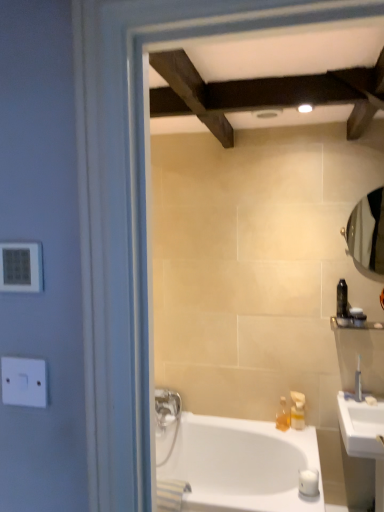
This screenshot has width=384, height=512. I want to click on translucent plastic soap dispenser at right, which appears as the third toiletry when viewed from the right, so click(x=297, y=410).

Describe the element at coordinates (309, 482) in the screenshot. I see `white matte soap at lower right` at that location.

Measure the distance between white plastic electric outlet at left, which is the 2th electric outlet in bottom-to-top order, and camera.

white plastic electric outlet at left, which is the 2th electric outlet in bottom-to-top order, is 28.49 inches away from camera.

What is the approximate height of white plastic electric outlet at left, acting as the first electric outlet starting from the top?

The height of white plastic electric outlet at left, acting as the first electric outlet starting from the top, is 3.70 inches.

The width and height of the screenshot is (384, 512). What are the coordinates of `satin nickel faucet at right` in the screenshot? It's located at (358, 382).

What is the approximate width of black glossy bottle at upper right, the 1th toiletry from the top?

It is 8.05 centimeters.

Image resolution: width=384 pixels, height=512 pixels. What are the coordinates of `translucent plastic soap dispenser at right, which appears as the third toiletry when viewed from the right` in the screenshot? It's located at (297, 410).

Is white glossy bathtub at lower center surrounded by black glossy bottle at upper right, the 2th toiletry in the left-to-right sequence?

Actually, white glossy bathtub at lower center is outside black glossy bottle at upper right, the 2th toiletry in the left-to-right sequence.

In terms of size, does black glossy bottle at upper right, which ranks as the 3th toiletry in bottom-to-top order, appear bigger or smaller than white glossy bathtub at lower center?

Considering their sizes, black glossy bottle at upper right, which ranks as the 3th toiletry in bottom-to-top order, takes up less space than white glossy bathtub at lower center.

Would you say black glossy bottle at upper right, the 1th toiletry from the top, is to the left or to the right of white glossy bathtub at lower center in the picture?

Based on their positions, black glossy bottle at upper right, the 1th toiletry from the top, is located to the right of white glossy bathtub at lower center.

From the image's perspective, which one is positioned lower, black glossy bottle at upper right, the 2th toiletry in the left-to-right sequence, or white glossy bathtub at lower center?

white glossy bathtub at lower center.

The image size is (384, 512). I want to click on mirror above the satin nickel faucet at right (from the image's perspective), so click(367, 231).

Consider the image. Which object is closer to the camera taking this photo, satin nickel faucet at right or clear glass mirror at right?

clear glass mirror at right is in front.

From a real-world perspective, is satin nickel faucet at right positioned under clear glass mirror at right based on gravity?

Indeed, from a real-world perspective, satin nickel faucet at right is positioned beneath clear glass mirror at right.

How much distance is there between satin nickel faucet at right and clear glass mirror at right?

satin nickel faucet at right and clear glass mirror at right are 65.45 centimeters apart.

Where is `bathtub located on the left of translucent plastic soap dispenser at right, which is the 1th toiletry in right-to-left order`? The height and width of the screenshot is (512, 384). bathtub located on the left of translucent plastic soap dispenser at right, which is the 1th toiletry in right-to-left order is located at coordinates (x=231, y=464).

Is white glossy bathtub at lower center aimed at translucent plastic soap dispenser at right, acting as the second toiletry starting from the top?

No, white glossy bathtub at lower center does not turn towards translucent plastic soap dispenser at right, acting as the second toiletry starting from the top.

From the image's perspective, which is below, white glossy bathtub at lower center or translucent plastic soap dispenser at right, which is the 1th toiletry in right-to-left order?

white glossy bathtub at lower center is shown below in the image.

Is white glossy bathtub at lower center to the left of black glossy bottle at upper right, the 1th toiletry from the top, from the viewer's perspective?

Yes, white glossy bathtub at lower center is to the left of black glossy bottle at upper right, the 1th toiletry from the top.

Who is smaller, white glossy bathtub at lower center or black glossy bottle at upper right, which ranks as the 3th toiletry in bottom-to-top order?

black glossy bottle at upper right, which ranks as the 3th toiletry in bottom-to-top order, is smaller.

Is white glossy bathtub at lower center taller or shorter than black glossy bottle at upper right, the 1th toiletry from the top?

Considering their sizes, white glossy bathtub at lower center has more height than black glossy bottle at upper right, the 1th toiletry from the top.

How far apart are white glossy bathtub at lower center and black glossy bottle at upper right, which ranks as the 3th toiletry in bottom-to-top order?

A distance of 36.80 inches exists between white glossy bathtub at lower center and black glossy bottle at upper right, which ranks as the 3th toiletry in bottom-to-top order.

Does satin nickel faucet at right have a lesser width compared to translucent plastic soap dispenser at right, positioned as the 2th toiletry in bottom-to-top order?

Yes.

Can you confirm if satin nickel faucet at right is bigger than translucent plastic soap dispenser at right, which is the 1th toiletry in right-to-left order?

→ Incorrect, satin nickel faucet at right is not larger than translucent plastic soap dispenser at right, which is the 1th toiletry in right-to-left order.

From a real-world perspective, does satin nickel faucet at right sit lower than translucent plastic soap dispenser at right, positioned as the 2th toiletry in bottom-to-top order?

Yes.

From the image's perspective, which one is positioned lower, satin nickel faucet at right or translucent plastic soap dispenser at right, acting as the second toiletry starting from the top?

satin nickel faucet at right appears lower in the image.

Considering the sizes of satin nickel faucet at right and white plastic switch at left, the second electric outlet when ordered from top to bottom, in the image, is satin nickel faucet at right taller or shorter than white plastic switch at left, the second electric outlet when ordered from top to bottom,?

In the image, satin nickel faucet at right appears to be taller than white plastic switch at left, the second electric outlet when ordered from top to bottom.

Would you say satin nickel faucet at right is to the left or to the right of white plastic switch at left, the second electric outlet when ordered from top to bottom, in the picture?

satin nickel faucet at right is positioned on white plastic switch at left, the second electric outlet when ordered from top to bottom,'s right side.

Does satin nickel faucet at right have a smaller size compared to white plastic switch at left, which is the first electric outlet in bottom-to-top order?

No.

Can you tell me how much satin nickel faucet at right and white plastic switch at left, the second electric outlet when ordered from top to bottom, differ in facing direction?

The facing directions of satin nickel faucet at right and white plastic switch at left, the second electric outlet when ordered from top to bottom, are 51 degrees apart.

Considering the sizes of white plastic electric outlet at left, which is the 2th electric outlet in bottom-to-top order, and white plastic switch at left, the second electric outlet when ordered from top to bottom, in the image, is white plastic electric outlet at left, which is the 2th electric outlet in bottom-to-top order, bigger or smaller than white plastic switch at left, the second electric outlet when ordered from top to bottom,?

Considering their sizes, white plastic electric outlet at left, which is the 2th electric outlet in bottom-to-top order, takes up less space than white plastic switch at left, the second electric outlet when ordered from top to bottom.

I want to click on electric outlet above the white plastic switch at left, the second electric outlet when ordered from top to bottom (from the image's perspective), so pyautogui.click(x=21, y=267).

Is white plastic electric outlet at left, which is the 2th electric outlet in bottom-to-top order, turned away from white plastic switch at left, the second electric outlet when ordered from top to bottom?

white plastic electric outlet at left, which is the 2th electric outlet in bottom-to-top order, does not have its back to white plastic switch at left, the second electric outlet when ordered from top to bottom.

Is white plastic electric outlet at left, acting as the first electric outlet starting from the top, spatially inside white plastic switch at left, the second electric outlet when ordered from top to bottom, or outside of it?

white plastic electric outlet at left, acting as the first electric outlet starting from the top, cannot be found inside white plastic switch at left, the second electric outlet when ordered from top to bottom.

In order to click on bathtub below the black glossy bottle at upper right, the 1th toiletry from the top (from the image's perspective) in this screenshot , I will do `click(231, 464)`.

The width and height of the screenshot is (384, 512). Identify the location of mirror that is on the right side of satin nickel faucet at right. (367, 231).

Estimate the real-world distances between objects in this image. Which object is further from white plastic switch at left, which is the first electric outlet in bottom-to-top order, white ceramic sink at lower right or black glossy bottle at upper right, the 2th toiletry in the left-to-right sequence?

black glossy bottle at upper right, the 2th toiletry in the left-to-right sequence.

When comparing their distances from translucent plastic soap dispenser at right, positioned as the 2th toiletry in bottom-to-top order, does white matte soap at lower right or white plastic electric outlet at left, which is the 2th electric outlet in bottom-to-top order, seem closer?

white matte soap at lower right lies closer to translucent plastic soap dispenser at right, positioned as the 2th toiletry in bottom-to-top order, than the other object.

Considering their positions, is white matte soap at lower right positioned further to clear glass mirror at right than white ceramic sink at lower right?

The object further to clear glass mirror at right is white matte soap at lower right.

Based on their spatial positions, is translucent plastic soap dispenser at right, which appears as the third toiletry when viewed from the right, or satin nickel faucet at right further from white plastic switch at left, which is the first electric outlet in bottom-to-top order?

Based on the image, satin nickel faucet at right appears to be further to white plastic switch at left, which is the first electric outlet in bottom-to-top order.

From the image, which object appears to be farther from translucent plastic soap dispenser at lower right, white ceramic sink at lower right or white matte soap at lower right?

white ceramic sink at lower right lies further to translucent plastic soap dispenser at lower right than the other object.

Looking at this image, considering their positions, is black glossy bottle at upper right, the second toiletry viewed from the right, positioned further to white plastic electric outlet at left, which is the 2th electric outlet in bottom-to-top order, than white matte soap at lower right?

The object further to white plastic electric outlet at left, which is the 2th electric outlet in bottom-to-top order, is black glossy bottle at upper right, the second toiletry viewed from the right.

Based on their spatial positions, is black glossy bottle at upper right, the second toiletry viewed from the right, or white plastic electric outlet at left, which is the 2th electric outlet in bottom-to-top order, closer to translucent plastic soap dispenser at right, positioned as the 2th toiletry in bottom-to-top order?

The object closer to translucent plastic soap dispenser at right, positioned as the 2th toiletry in bottom-to-top order, is black glossy bottle at upper right, the second toiletry viewed from the right.

Which object lies nearer to the anchor point translucent plastic soap dispenser at lower right, clear glass mirror at right or white glossy bathtub at lower center?

white glossy bathtub at lower center.

Where is `sink between white plastic electric outlet at left, which is the 2th electric outlet in bottom-to-top order, and translucent plastic soap dispenser at right, which is the 1th toiletry in right-to-left order, from front to back`? This screenshot has width=384, height=512. sink between white plastic electric outlet at left, which is the 2th electric outlet in bottom-to-top order, and translucent plastic soap dispenser at right, which is the 1th toiletry in right-to-left order, from front to back is located at coordinates tap(362, 447).

Find the location of a particular element. soap dispenser between white glossy bathtub at lower center and satin nickel faucet at right is located at coordinates (283, 416).

Locate an element on the screen. faucet between white plastic switch at left, the second electric outlet when ordered from top to bottom, and translucent plastic soap dispenser at lower right in the front-back direction is located at coordinates (358, 382).

Locate an element on the screen. soap situated between white plastic switch at left, the second electric outlet when ordered from top to bottom, and white ceramic sink at lower right from left to right is located at coordinates (309, 482).